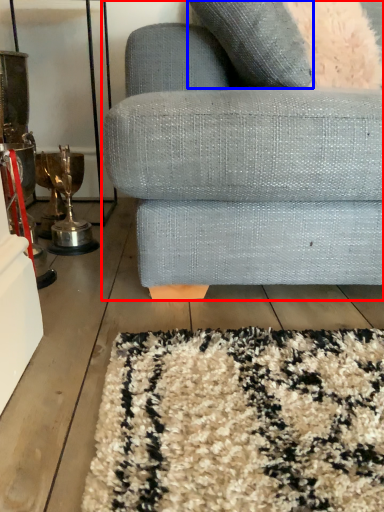
Question: Among these objects, which one is nearest to the camera, studio couch (highlighted by a red box) or throw pillow (highlighted by a blue box)?

Choices:
 (A) studio couch
 (B) throw pillow

Answer: (A)